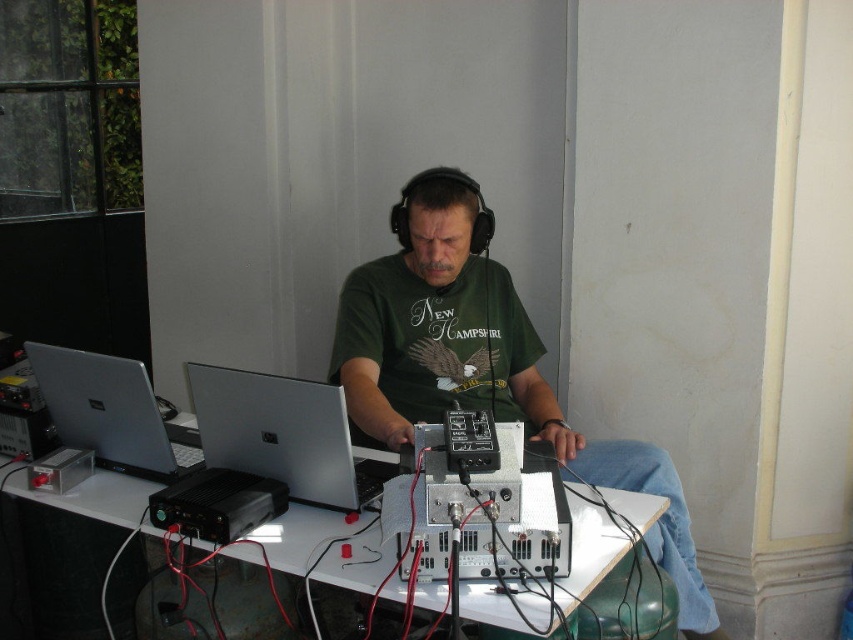
Who is more forward, (x=339, y=458) or (x=86, y=433)?

Point (x=339, y=458)

Does point (340, 488) come closer to viewer compared to point (131, 378)?

Yes, point (340, 488) is closer to viewer.

At what (x,y) coordinates should I click in order to perform the action: click on silver metallic laptop at center. Please return your answer as a coordinate pair (x, y). The width and height of the screenshot is (853, 640). Looking at the image, I should click on (283, 435).

Is white plastic table at center taller than silver metallic laptop at left?

No, white plastic table at center is not taller than silver metallic laptop at left.

Which is more to the left, white plastic table at center or silver metallic laptop at left?

silver metallic laptop at left

Does point (84, 513) lie in front of point (119, 401)?

Yes, it is in front of point (119, 401).

In order to click on white plastic table at center in this screenshot , I will do `click(321, 547)`.

Is green matte shirt at center closer to the viewer compared to silver metallic laptop at left?

Yes, green matte shirt at center is closer to the viewer.

Is point (479, 298) positioned before point (88, 381)?

No, it is behind (88, 381).

Is point (537, 404) closer to viewer compared to point (192, 442)?

No, (537, 404) is behind (192, 442).

Find the location of a particular element. green matte shirt at center is located at coordinates (480, 364).